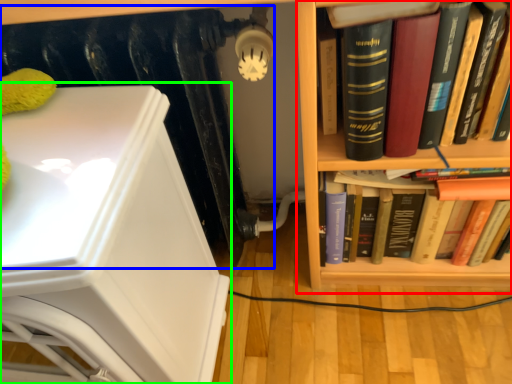
Question: Which is farther away from bookcase (highlighted by a red box)? radiator (highlighted by a blue box) or armchair (highlighted by a green box)?

Choices:
 (A) radiator
 (B) armchair

Answer: (B)